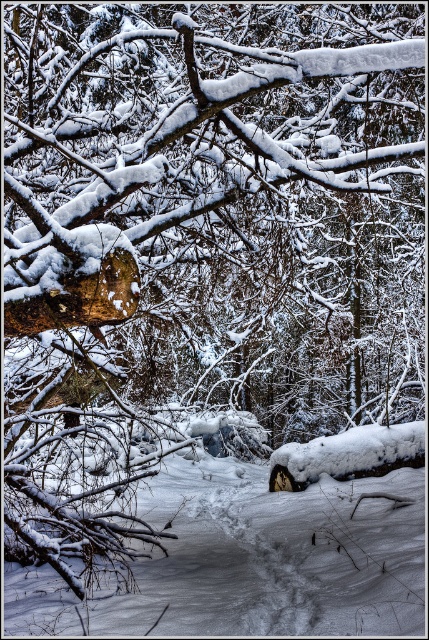
You are a hiker trying to cross the forest path. You see the smooth brown log at upper left and the white fluffy snow at center. Which one is closer to you?

The smooth brown log at upper left is closer to the viewer than the white fluffy snow at center.